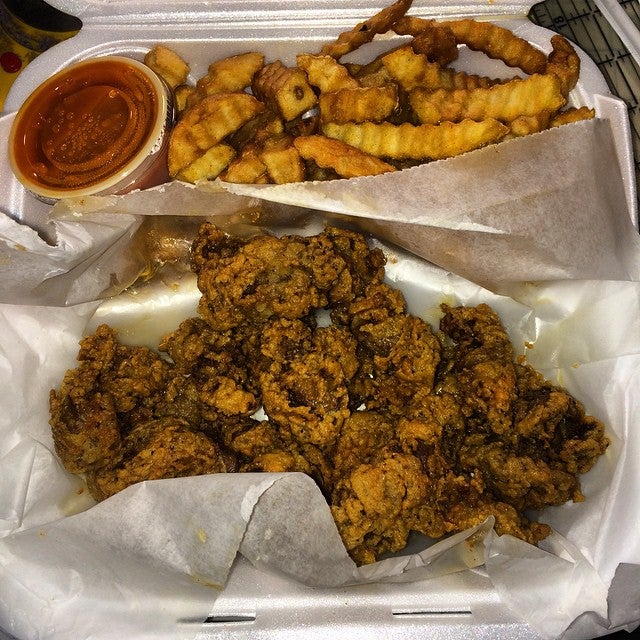
At what (x,y) coordinates should I click in order to perform the action: click on plastic container of ketchup. Please return your answer as a coordinate pair (x, y). This screenshot has height=640, width=640. Looking at the image, I should click on (116, 155).